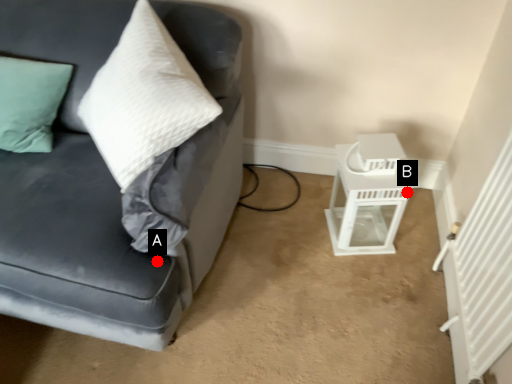
Question: Two points are circled on the image, labeled by A and B beside each circle. Which of the following is the farthest from the observer?

Choices:
 (A) A is further
 (B) B is further

Answer: (B)